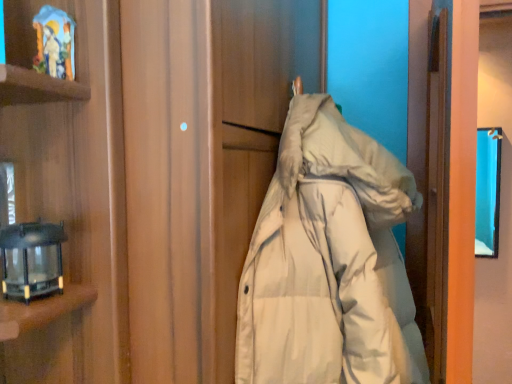
Locate an element on the screen. The width and height of the screenshot is (512, 384). white down jacket at center is located at coordinates (326, 259).

The image size is (512, 384). What do you see at coordinates (326, 259) in the screenshot?
I see `white down jacket at center` at bounding box center [326, 259].

Measure the distance between white down jacket at center and camera.

white down jacket at center is 30.18 inches away from camera.

Where is `black glass lantern at left`? This screenshot has height=384, width=512. black glass lantern at left is located at coordinates (32, 259).

This screenshot has height=384, width=512. Describe the element at coordinates (32, 259) in the screenshot. I see `black glass lantern at left` at that location.

What are the coordinates of `white down jacket at center` in the screenshot? It's located at (326, 259).

Considering the relative positions of black glass lantern at left and white down jacket at center in the image provided, is black glass lantern at left to the left of white down jacket at center from the viewer's perspective?

Indeed, black glass lantern at left is positioned on the left side of white down jacket at center.

Is black glass lantern at left in front of white down jacket at center?

No, the depth of black glass lantern at left is greater than that of white down jacket at center.

Considering the points (40, 261) and (273, 346), which point is behind, point (40, 261) or point (273, 346)?

The point (273, 346) is behind.

From the image's perspective, which is below, black glass lantern at left or white down jacket at center?

From the image's view, white down jacket at center is below.

From a real-world perspective, which object rests below the other?

From a 3D spatial view, white down jacket at center is below.

Considering the sizes of objects black glass lantern at left and white down jacket at center in the image provided, who is wider, black glass lantern at left or white down jacket at center?

white down jacket at center is wider.

Who is shorter, black glass lantern at left or white down jacket at center?

black glass lantern at left.

Who is bigger, black glass lantern at left or white down jacket at center?

With larger size is white down jacket at center.

Based on the photo, is black glass lantern at left surrounding white down jacket at center?

No.

Is black glass lantern at left positioned far away from white down jacket at center?

No, black glass lantern at left is not far away from white down jacket at center.

Does black glass lantern at left turn towards white down jacket at center?

No, black glass lantern at left does not turn towards white down jacket at center.

Find the location of `lamp that appears on the left of white down jacket at center`. lamp that appears on the left of white down jacket at center is located at coordinates (32, 259).

Is white down jacket at center to the left of black glass lantern at left from the viewer's perspective?

No, white down jacket at center is not to the left of black glass lantern at left.

Is white down jacket at center further to the viewer compared to black glass lantern at left?

No, white down jacket at center is closer to the viewer.

Is point (246, 318) closer to viewer compared to point (64, 239)?

That is False.

From the image's perspective, does white down jacket at center appear lower than black glass lantern at left?

Yes, from the image's perspective, white down jacket at center is below black glass lantern at left.

From a real-world perspective, is white down jacket at center located higher than black glass lantern at left?

No.

Is white down jacket at center wider or thinner than black glass lantern at left?

In the image, white down jacket at center appears to be wider than black glass lantern at left.

Does white down jacket at center have a lesser height compared to black glass lantern at left?

Incorrect, the height of white down jacket at center does not fall short of that of black glass lantern at left.

Is white down jacket at center bigger than black glass lantern at left?

Indeed, white down jacket at center has a larger size compared to black glass lantern at left.

From the picture: Is white down jacket at center situated inside black glass lantern at left or outside?

white down jacket at center is outside black glass lantern at left.

Is white down jacket at center far from black glass lantern at left?

white down jacket at center is actually quite close to black glass lantern at left.

Is white down jacket at center looking in the opposite direction of black glass lantern at left?

No, white down jacket at center is not facing away from black glass lantern at left.

Can you tell me how much white down jacket at center and black glass lantern at left differ in facing direction?

There is a 3.39-degree angle between the facing directions of white down jacket at center and black glass lantern at left.

Locate an element on the screen. The width and height of the screenshot is (512, 384). jacket located below the black glass lantern at left (from the image's perspective) is located at coordinates (326, 259).

Find the location of `jacket below the black glass lantern at left (from the image's perspective)`. jacket below the black glass lantern at left (from the image's perspective) is located at coordinates (326, 259).

At what (x,y) coordinates should I click in order to perform the action: click on jacket that is on the right side of black glass lantern at left. Please return your answer as a coordinate pair (x, y). This screenshot has height=384, width=512. Looking at the image, I should click on (326, 259).